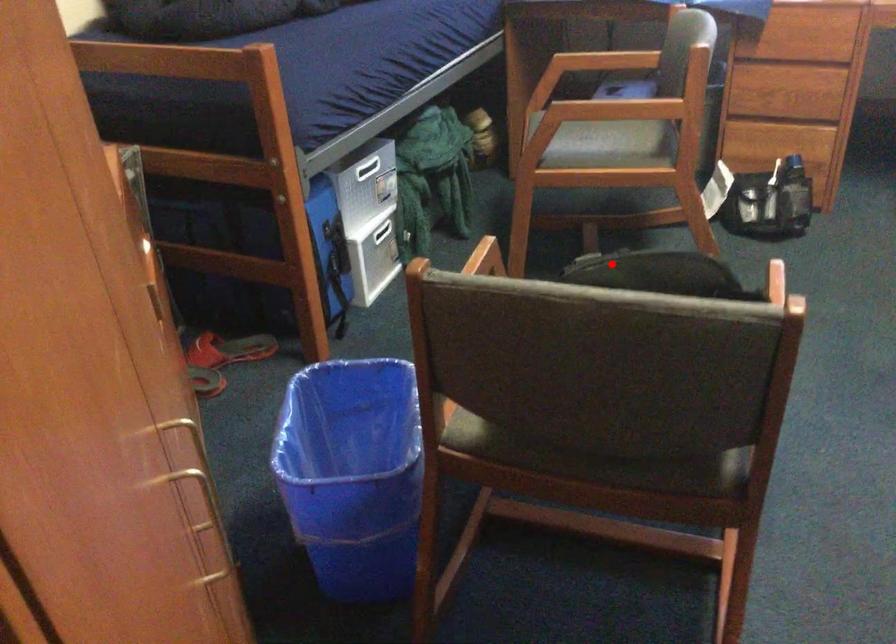
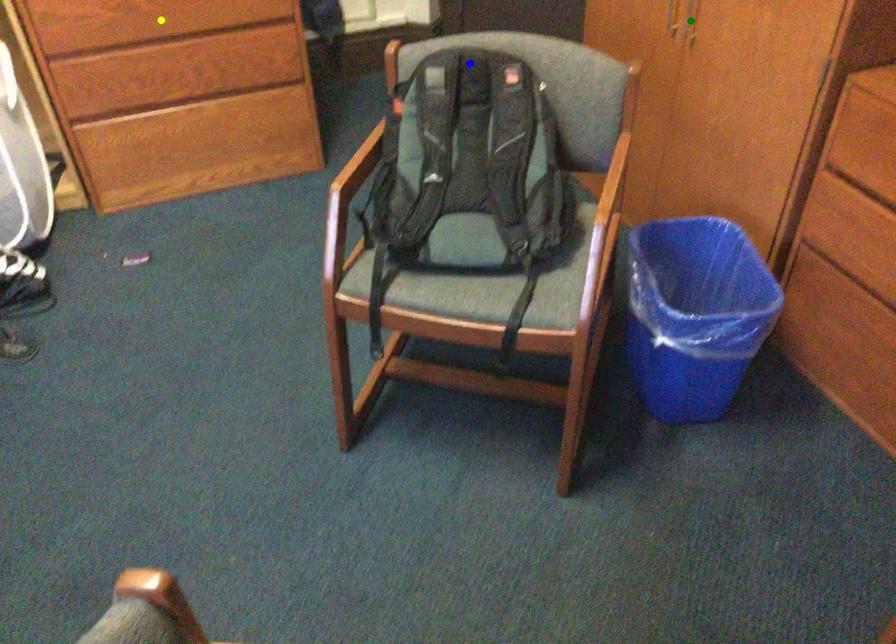
Question: I am providing you with two images of the same scene from different viewpoints. A red point is marked on the first image. You are given multiple points on the second image. In image 2, which mark is for the same physical point as the one in image 1?

Choices:
 (A) green point
 (B) blue point
 (C) yellow point

Answer: (B)